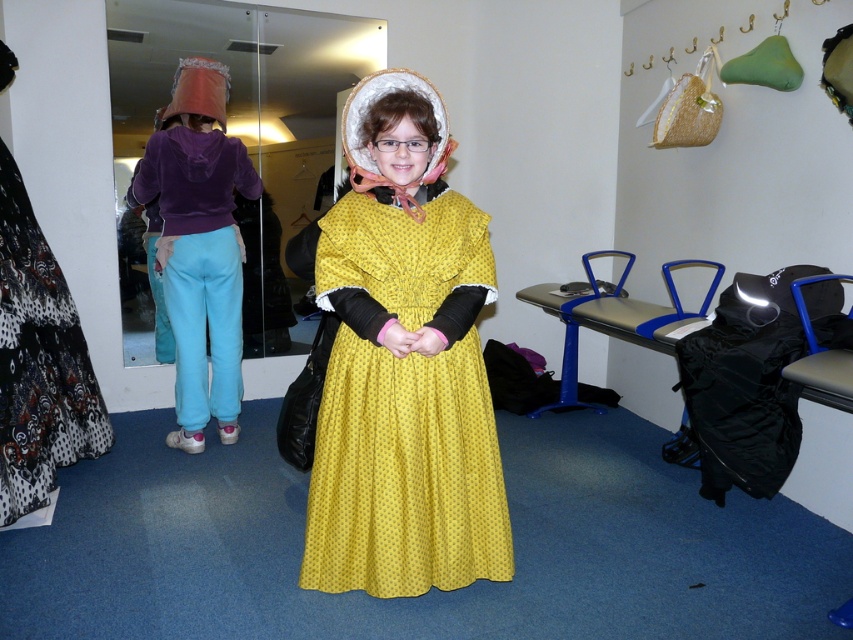
Question: Is yellow dotted fabric dress at center positioned behind purple velvet hoodie at left?

Choices:
 (A) no
 (B) yes

Answer: (A)

Question: Which object appears farthest from the camera in this image?

Choices:
 (A) purple velvet hoodie at left
 (B) yellow dotted fabric dress at center
 (C) black and white patterned skirt at left

Answer: (A)

Question: Does purple velvet hoodie at left have a lesser width compared to black and white patterned skirt at left?

Choices:
 (A) yes
 (B) no

Answer: (B)

Question: Does purple velvet hoodie at left appear on the right side of black and white patterned skirt at left?

Choices:
 (A) no
 (B) yes

Answer: (B)

Question: Which point is closer to the camera?

Choices:
 (A) purple velvet hoodie at left
 (B) yellow dotted fabric dress at center
 (C) black and white patterned skirt at left

Answer: (B)

Question: Based on their relative distances, which object is farther from the purple velvet hoodie at left?

Choices:
 (A) yellow dotted fabric dress at center
 (B) black and white patterned skirt at left

Answer: (A)